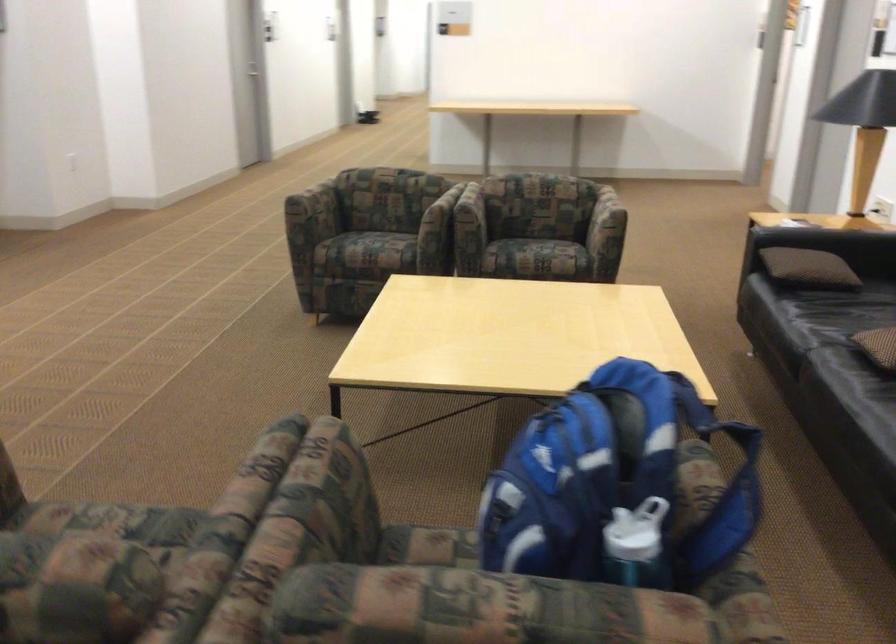
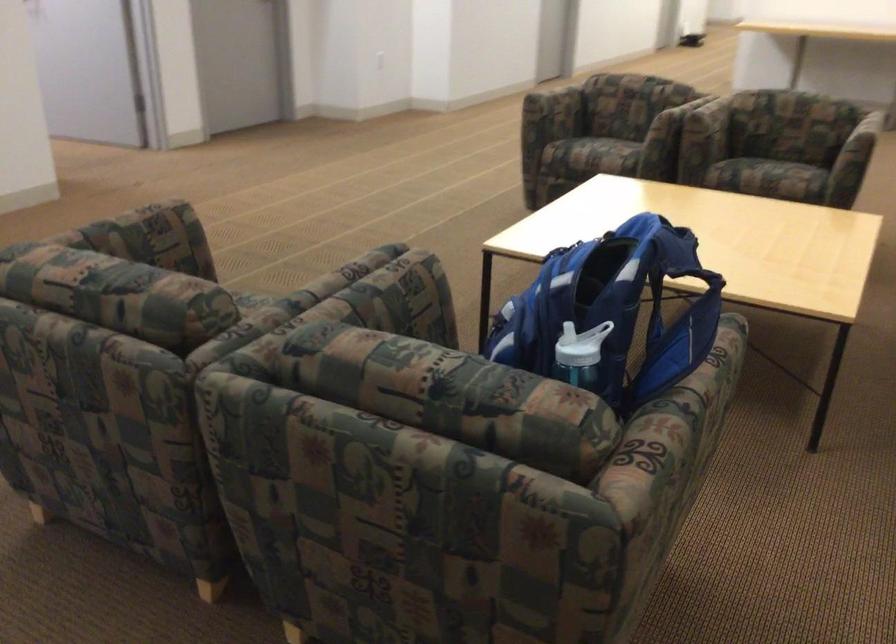
Where in the second image is the point corresponding to (626,234) from the first image?

(858, 152)